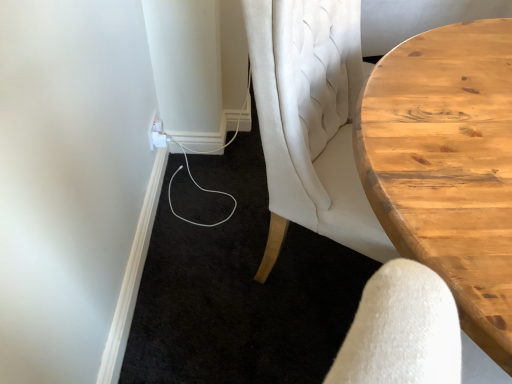
Question: From a real-world perspective, relative to wooden table at right, is white plastic outlet at lower left vertically above or below?

Choices:
 (A) below
 (B) above

Answer: (A)

Question: Considering the positions of point (160, 120) and point (472, 203), is point (160, 120) closer or farther from the camera than point (472, 203)?

Choices:
 (A) closer
 (B) farther

Answer: (B)

Question: Considering their positions, is white plastic outlet at lower left located in front of or behind wooden table at right?

Choices:
 (A) front
 (B) behind

Answer: (B)

Question: Does point (376, 100) appear closer or farther from the camera than point (152, 135)?

Choices:
 (A) farther
 (B) closer

Answer: (B)

Question: Choose the correct answer: Is wooden table at right inside white plastic outlet at lower left or outside it?

Choices:
 (A) inside
 (B) outside

Answer: (B)

Question: From a real-world perspective, is wooden table at right physically located above or below white plastic outlet at lower left?

Choices:
 (A) above
 (B) below

Answer: (A)

Question: In terms of width, does wooden table at right look wider or thinner when compared to white plastic outlet at lower left?

Choices:
 (A) wide
 (B) thin

Answer: (A)